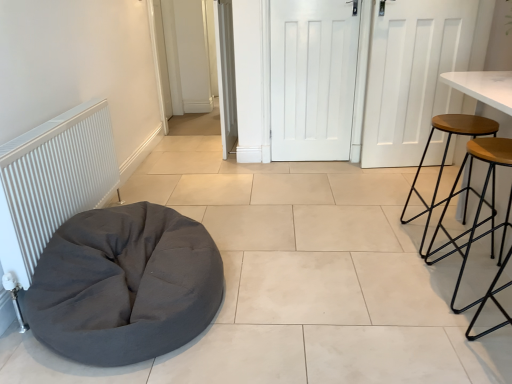
Question: Does dark gray fabric bean bag at lower left have a lesser height compared to wooden seat stool at right, acting as the second stool starting from the back?

Choices:
 (A) no
 (B) yes

Answer: (B)

Question: Can you see dark gray fabric bean bag at lower left touching wooden seat stool at right, which is the first stool in front-to-back order?

Choices:
 (A) yes
 (B) no

Answer: (B)

Question: Is dark gray fabric bean bag at lower left at the left side of wooden seat stool at right, acting as the second stool starting from the back?

Choices:
 (A) yes
 (B) no

Answer: (A)

Question: Considering the relative positions of dark gray fabric bean bag at lower left and wooden seat stool at right, which is the first stool in front-to-back order, in the image provided, is dark gray fabric bean bag at lower left behind wooden seat stool at right, which is the first stool in front-to-back order,?

Choices:
 (A) no
 (B) yes

Answer: (A)

Question: Is dark gray fabric bean bag at lower left facing towards wooden seat stool at right, which is the first stool in front-to-back order?

Choices:
 (A) no
 (B) yes

Answer: (B)

Question: Is dark gray fabric bean bag at lower left not near wooden seat stool at right, which is the first stool in front-to-back order?

Choices:
 (A) yes
 (B) no

Answer: (A)

Question: Considering the relative sizes of dark gray fabric bean bag at lower left and white ribbed radiator at left in the image provided, is dark gray fabric bean bag at lower left shorter than white ribbed radiator at left?

Choices:
 (A) no
 (B) yes

Answer: (B)

Question: From the image's perspective, does dark gray fabric bean bag at lower left appear higher than white ribbed radiator at left?

Choices:
 (A) yes
 (B) no

Answer: (B)

Question: Is dark gray fabric bean bag at lower left positioned with its back to white ribbed radiator at left?

Choices:
 (A) no
 (B) yes

Answer: (B)

Question: Does dark gray fabric bean bag at lower left come behind white ribbed radiator at left?

Choices:
 (A) no
 (B) yes

Answer: (A)

Question: Does dark gray fabric bean bag at lower left have a larger size compared to white ribbed radiator at left?

Choices:
 (A) no
 (B) yes

Answer: (B)

Question: From a real-world perspective, does dark gray fabric bean bag at lower left stand above white ribbed radiator at left?

Choices:
 (A) yes
 (B) no

Answer: (B)

Question: Is wooden seat stool at right, acting as the second stool starting from the back, completely or partially inside white matte door at center, positioned as the 2th door in left-to-right order?

Choices:
 (A) yes
 (B) no

Answer: (B)